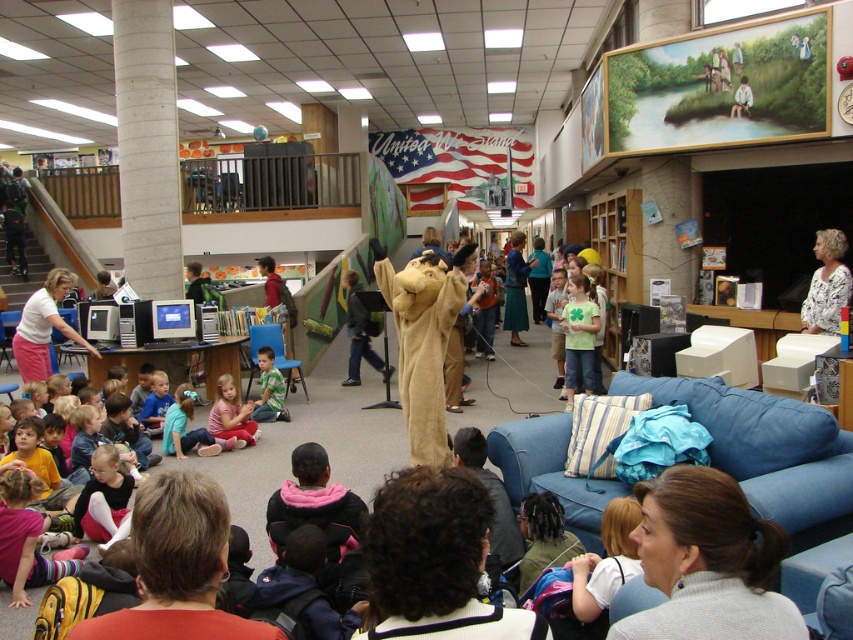
Question: Is the position of pink fabric pants at lower center more distant than that of green matte shirt at lower center?

Choices:
 (A) yes
 (B) no

Answer: (B)

Question: Is pink fabric pants at lower center wider than green matte shirt at lower center?

Choices:
 (A) yes
 (B) no

Answer: (A)

Question: Is pink fabric pants at lower center in front of green matte shirt at lower center?

Choices:
 (A) no
 (B) yes

Answer: (B)

Question: Which object is closer to the camera taking this photo?

Choices:
 (A) green matte shirt at lower center
 (B) pink fabric pants at lower center

Answer: (B)